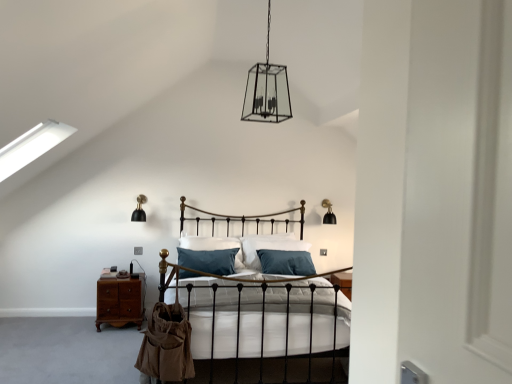
Question: Would you say mahogany wood nightstand at lower left is a long distance from matte black bed at center?

Choices:
 (A) no
 (B) yes

Answer: (B)

Question: From a real-world perspective, is mahogany wood nightstand at lower left on matte black bed at center?

Choices:
 (A) yes
 (B) no

Answer: (B)

Question: Is the position of mahogany wood nightstand at lower left more distant than that of matte black bed at center?

Choices:
 (A) yes
 (B) no

Answer: (A)

Question: Is mahogany wood nightstand at lower left completely or partially outside of matte black bed at center?

Choices:
 (A) yes
 (B) no

Answer: (A)

Question: From a real-world perspective, is mahogany wood nightstand at lower left located beneath matte black bed at center?

Choices:
 (A) no
 (B) yes

Answer: (B)

Question: Considering the relative sizes of mahogany wood nightstand at lower left and matte black bed at center in the image provided, is mahogany wood nightstand at lower left smaller than matte black bed at center?

Choices:
 (A) no
 (B) yes

Answer: (B)

Question: Does mahogany wood nightstand at lower left appear on the right side of black matte wall sconce at left, the second light fixture in the front-to-back sequence?

Choices:
 (A) no
 (B) yes

Answer: (A)

Question: Is mahogany wood nightstand at lower left beside black matte wall sconce at left, positioned as the 2th light fixture in bottom-to-top order?

Choices:
 (A) yes
 (B) no

Answer: (B)

Question: Would you say mahogany wood nightstand at lower left is a long distance from black matte wall sconce at left, the 3th light fixture from the right?

Choices:
 (A) no
 (B) yes

Answer: (A)

Question: Is mahogany wood nightstand at lower left outside of black matte wall sconce at left, the second light fixture in the front-to-back sequence?

Choices:
 (A) yes
 (B) no

Answer: (A)

Question: From a real-world perspective, is mahogany wood nightstand at lower left located higher than black matte wall sconce at left, positioned as the 2th light fixture in bottom-to-top order?

Choices:
 (A) yes
 (B) no

Answer: (B)

Question: Is black matte wall sconce at left, acting as the second light fixture starting from the top, at the back of mahogany wood nightstand at lower left?

Choices:
 (A) no
 (B) yes

Answer: (A)

Question: From the image's perspective, is teal fabric pillow at center located above clear glass lantern at center, which is the 2th light fixture in left-to-right order?

Choices:
 (A) no
 (B) yes

Answer: (A)